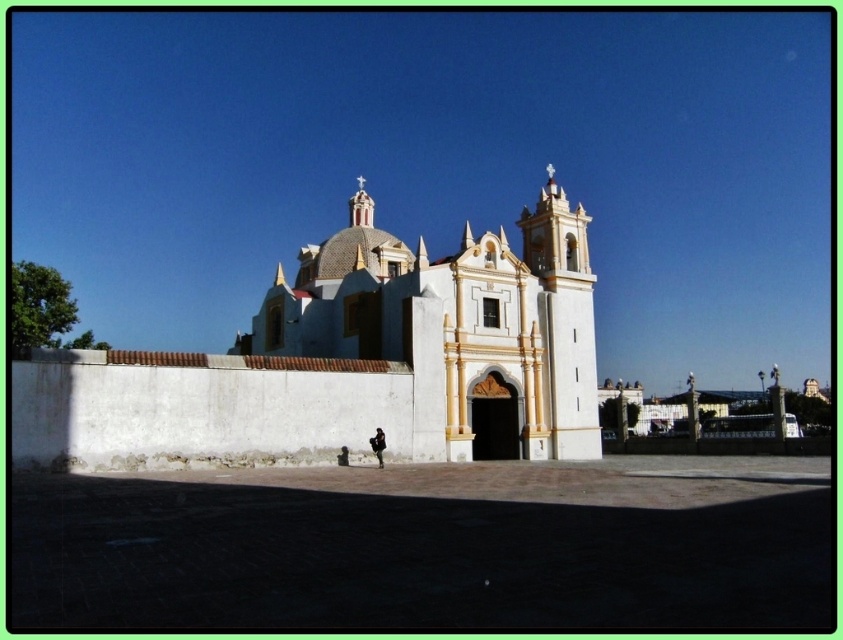
In the scene shown: Does white stucco church at center appear on the right side of dark gray fabric jacket at lower center?

In fact, white stucco church at center is to the left of dark gray fabric jacket at lower center.

Can you confirm if white stucco church at center is bigger than dark gray fabric jacket at lower center?

Yes, white stucco church at center is bigger than dark gray fabric jacket at lower center.

Measure the distance between white stucco church at center and camera.

They are 47.53 meters apart.

Image resolution: width=843 pixels, height=640 pixels. In order to click on white stucco church at center in this screenshot , I will do `click(455, 324)`.